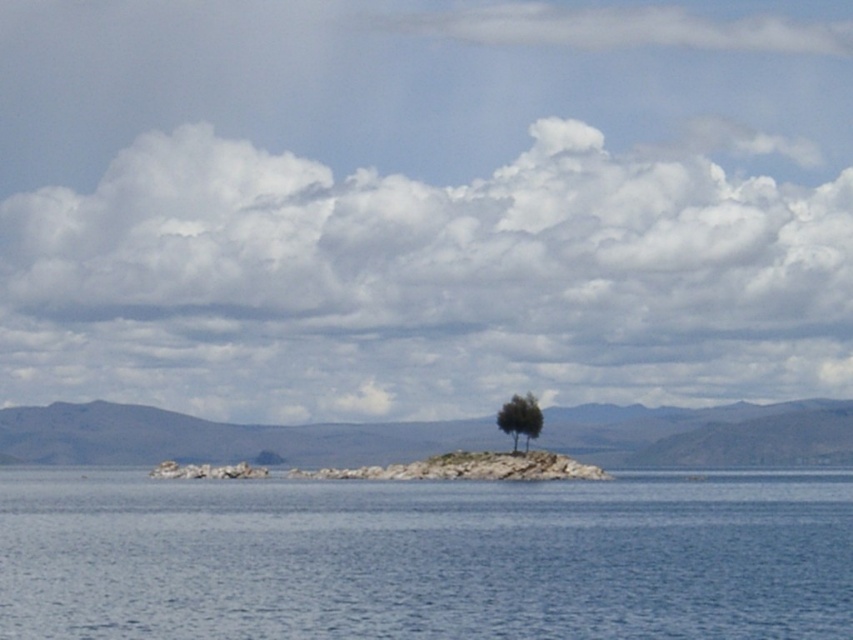
Question: Does clear blue water at center appear on the right side of green leafy tree at center?

Choices:
 (A) no
 (B) yes

Answer: (A)

Question: Which point is closer to the camera?

Choices:
 (A) (646, 541)
 (B) (512, 417)

Answer: (A)

Question: Which point is farther to the camera?

Choices:
 (A) (534, 433)
 (B) (241, 563)

Answer: (A)

Question: Which of the following is the closest to the observer?

Choices:
 (A) (846, 593)
 (B) (521, 429)

Answer: (A)

Question: Does clear blue water at center appear on the right side of green leafy tree at center?

Choices:
 (A) yes
 (B) no

Answer: (B)

Question: Observing the image, what is the correct spatial positioning of clear blue water at center in reference to green leafy tree at center?

Choices:
 (A) left
 (B) right

Answer: (A)